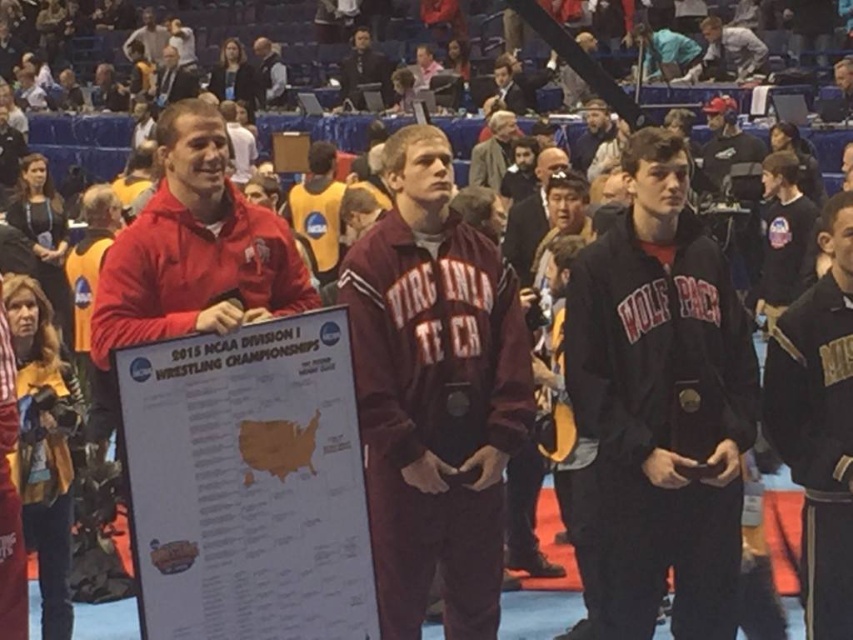
Is point (506, 122) behind point (587, 144)?

No, (506, 122) is closer to viewer.

Between point (508, 128) and point (579, 140), which one is positioned behind?

The point (579, 140) is behind.

This screenshot has height=640, width=853. What are the coordinates of `gray wool jacket at upper center` in the screenshot? It's located at (492, 150).

You are a GUI agent. You are given a task and a screenshot of the screen. Output one action in this format:
    pyautogui.click(x=<x>, y=<y>)
    Task: Click on the black matte jacket at center
    This screenshot has width=853, height=640.
    Given the screenshot: What is the action you would take?
    pyautogui.click(x=660, y=404)

In the scene shown: Does black matte jacket at center have a greater width compared to dark blue jacket at upper center?

No, black matte jacket at center is not wider than dark blue jacket at upper center.

Who is more distant from viewer, (701,552) or (360,99)?

Positioned behind is point (360,99).

This screenshot has width=853, height=640. In order to click on black matte jacket at center in this screenshot , I will do [x=660, y=404].

Is black matte jacket at center to the left of maroon fleece jacket at center from the viewer's perspective?

No, black matte jacket at center is not to the left of maroon fleece jacket at center.

Is black matte jacket at center smaller than maroon fleece jacket at center?

Incorrect, black matte jacket at center is not smaller in size than maroon fleece jacket at center.

Where is `black matte jacket at center`? The height and width of the screenshot is (640, 853). black matte jacket at center is located at coordinates (660, 404).